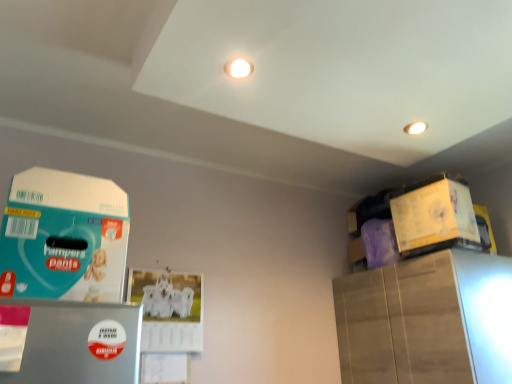
Question: Is yellow cardboard box at upper right, which is the second box from left to right, bigger or smaller than teal matte paper at left, which ranks as the 2th box in back-to-front order?

Choices:
 (A) small
 (B) big

Answer: (A)

Question: From a real-world perspective, is yellow cardboard box at upper right, which is the second box from left to right, above or below teal matte paper at left, which ranks as the 2th box in back-to-front order?

Choices:
 (A) above
 (B) below

Answer: (A)

Question: Considering the positions of point (425, 206) and point (125, 235), is point (425, 206) closer or farther from the camera than point (125, 235)?

Choices:
 (A) closer
 (B) farther

Answer: (B)

Question: Choose the correct answer: Is teal matte paper at left, which ranks as the 2th box in back-to-front order, inside yellow cardboard box at upper right, which is counted as the 1th box, starting from the right, or outside it?

Choices:
 (A) outside
 (B) inside

Answer: (A)

Question: In the image, is teal matte paper at left, which ranks as the 2th box in back-to-front order, on the left side or the right side of yellow cardboard box at upper right, which is the second box from left to right?

Choices:
 (A) right
 (B) left

Answer: (B)

Question: From a real-world perspective, is teal matte paper at left, the 1th box from the left, positioned above or below yellow cardboard box at upper right, which is the second box from left to right?

Choices:
 (A) above
 (B) below

Answer: (B)

Question: From the image's perspective, relative to yellow cardboard box at upper right, which is the second box from left to right, is teal matte paper at left, which ranks as the 2th box in back-to-front order, above or below?

Choices:
 (A) below
 (B) above

Answer: (A)